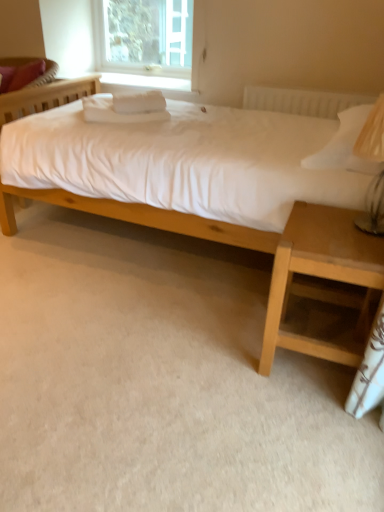
Question: Can you confirm if clear glass window at upper center is wider than matte wood bed at center?

Choices:
 (A) no
 (B) yes

Answer: (A)

Question: From a real-world perspective, is clear glass window at upper center over matte wood bed at center?

Choices:
 (A) yes
 (B) no

Answer: (A)

Question: Are clear glass window at upper center and matte wood bed at center beside each other?

Choices:
 (A) yes
 (B) no

Answer: (B)

Question: Can you confirm if clear glass window at upper center is thinner than matte wood bed at center?

Choices:
 (A) no
 (B) yes

Answer: (B)

Question: Does clear glass window at upper center have a lesser height compared to matte wood bed at center?

Choices:
 (A) yes
 (B) no

Answer: (A)

Question: Is clear glass window at upper center inside the boundaries of light brown wood nightstand at lower right, or outside?

Choices:
 (A) inside
 (B) outside

Answer: (B)

Question: Would you say clear glass window at upper center is to the left or to the right of light brown wood nightstand at lower right in the picture?

Choices:
 (A) left
 (B) right

Answer: (A)

Question: From the image's perspective, is clear glass window at upper center positioned above or below light brown wood nightstand at lower right?

Choices:
 (A) above
 (B) below

Answer: (A)

Question: Does point 152,33 appear closer or farther from the camera than point 266,325?

Choices:
 (A) farther
 (B) closer

Answer: (A)

Question: In terms of size, does clear glass window at upper center appear bigger or smaller than matte pink pillow at upper left?

Choices:
 (A) small
 (B) big

Answer: (B)

Question: In terms of height, does clear glass window at upper center look taller or shorter compared to matte pink pillow at upper left?

Choices:
 (A) tall
 (B) short

Answer: (A)

Question: Does point (107, 18) appear closer or farther from the camera than point (29, 74)?

Choices:
 (A) closer
 (B) farther

Answer: (B)

Question: From a real-world perspective, relative to matte pink pillow at upper left, is clear glass window at upper center vertically above or below?

Choices:
 (A) above
 (B) below

Answer: (A)

Question: Looking at the image, does matte wood bed at center seem bigger or smaller compared to clear glass window at upper center?

Choices:
 (A) big
 (B) small

Answer: (A)

Question: In the image, is matte wood bed at center on the left side or the right side of clear glass window at upper center?

Choices:
 (A) left
 (B) right

Answer: (B)